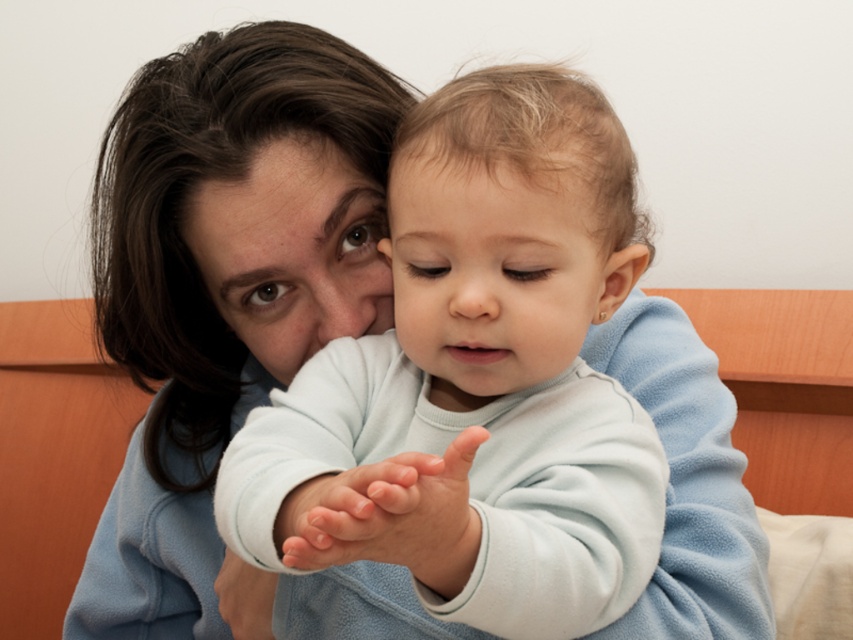
You are a photographer adjusting lighting for a portrait. You notice the smooth skin forehead at center and the smooth skin hand at center in the frame. Which of these two body parts appears closer to the camera?

The smooth skin forehead at center appears closer to the camera because it has a lesser height compared to the smooth skin hand at center, indicating it is positioned nearer in the scene.

You are an observer in the scene. You notice the light blue fleece at center and the smooth white hand at center. Which object is positioned more to the right?

The light blue fleece at center is positioned to the right of the smooth white hand at center.

You are an artist sketching this scene and want to add depth by shading the area between the two points, point (497, 621) and point (331, 477). Which point should you shade closer to the viewer to create a sense of depth?

Point (497, 621) is further to the viewer than point (331, 477), so you should shade point (497, 621) closer to the viewer to create depth.